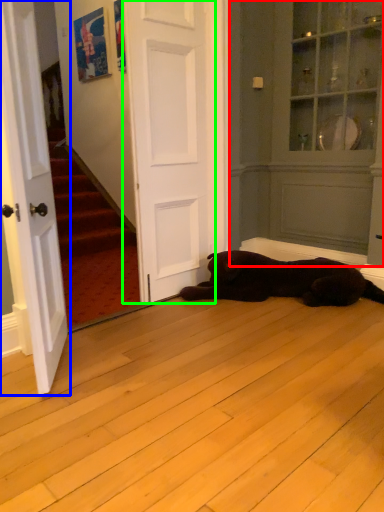
Question: Which is farther away from armoire (highlighted by a red box)? door (highlighted by a blue box) or door (highlighted by a green box)?

Choices:
 (A) door
 (B) door

Answer: (A)